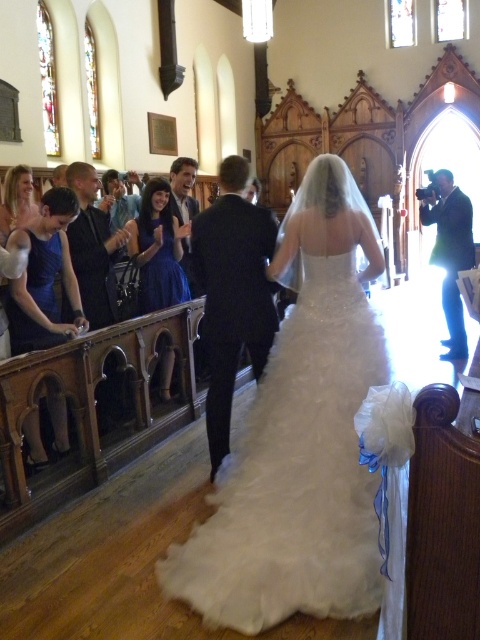
You are a photographer positioned at the front of the aisle. You want to capture a photo of both the dark gray suit at center and the matte black suit at center without any obstructions. Which suit should you adjust your focus to prioritize to ensure both are visible in the frame?

The dark gray suit at center is in front of the matte black suit at center, so you should focus on the dark gray suit at center first to ensure both are visible in the frame.

You are a photographer positioned at the front of the church aisle. You need to capture a photo of both the dark gray suit at center and the matte black suit at center. Which suit is closer to the camera?

The dark gray suit at center is located below the matte black suit at center, so the dark gray suit at center is closer to the camera.

You are a photographer positioned at the front of the church aisle. You need to take a photo of both the dark suit at center and the matte black suit at center. Which one should you adjust your camera angle to focus on first if you want to capture both in the frame without moving the camera?

You should focus on the matte black suit at center first because it is positioned to the left of the dark suit at center, so capturing it first ensures both are within the frame without needing to reposition the camera.